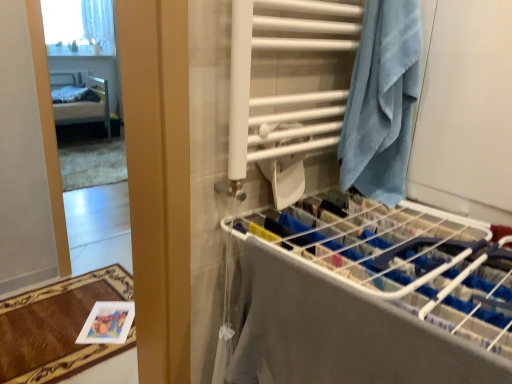
Question: Considering their positions, is white plastic drying rack at center right located in front of or behind brown plush bath mat at lower left?

Choices:
 (A) behind
 (B) front

Answer: (B)

Question: In terms of height, does white plastic drying rack at center right look taller or shorter compared to brown plush bath mat at lower left?

Choices:
 (A) tall
 (B) short

Answer: (A)

Question: Which of these objects is positioned farthest from the clear glass mirror at left?

Choices:
 (A) blue terry cloth towel at right
 (B) brown plush bath mat at lower left
 (C) white plastic drying rack at center right
 (D) white sheer curtain at upper left
 (E) blue towel at right

Answer: (E)

Question: Estimate the real-world distances between objects in this image. Which object is farther from the metallic silver bed at left?

Choices:
 (A) blue terry cloth towel at right
 (B) white plastic drying rack at center right
 (C) blue towel at right
 (D) brown plush bath mat at lower left
 (E) white sheer curtain at upper left

Answer: (C)